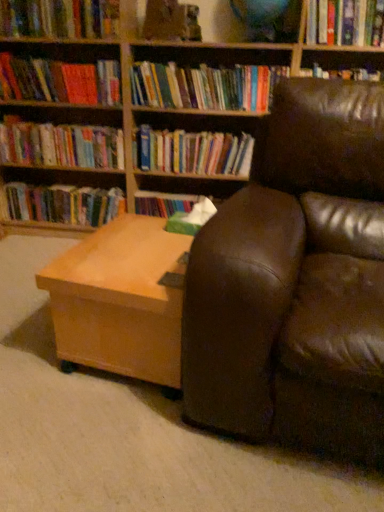
Question: From a real-world perspective, relative to hardcover books at left, which appears as the 3th book when ordered from the bottom, is hardcover book at upper center, which is counted as the fourth book, starting from the bottom, vertically above or below?

Choices:
 (A) below
 (B) above

Answer: (B)

Question: Considering the positions of point (230, 92) and point (16, 138), is point (230, 92) closer or farther from the camera than point (16, 138)?

Choices:
 (A) farther
 (B) closer

Answer: (B)

Question: Which object is the closest to the hardcover books at center, which is counted as the second book, starting from the bottom?

Choices:
 (A) hardcover books at left, which is the 6th book from top to bottom
 (B) light brown wood table at lower left
 (C) brown leather couch at right
 (D) hardcover book at upper center, arranged as the fifth book when viewed from the top
 (E) hardcover book at upper left, arranged as the sixth book when ordered from the bottom

Answer: (D)

Question: Which object is the closest to the hardcover book at upper center, which is counted as the fourth book, starting from the bottom?

Choices:
 (A) hardcover books at center, which is counted as the second book, starting from the bottom
 (B) hardcover book at upper left, arranged as the 3th book when viewed from the top
 (C) light brown wood table at lower left
 (D) hardcover book at upper left, which appears as the 8th book when ordered from the bottom
 (E) brown leather couch at right

Answer: (A)